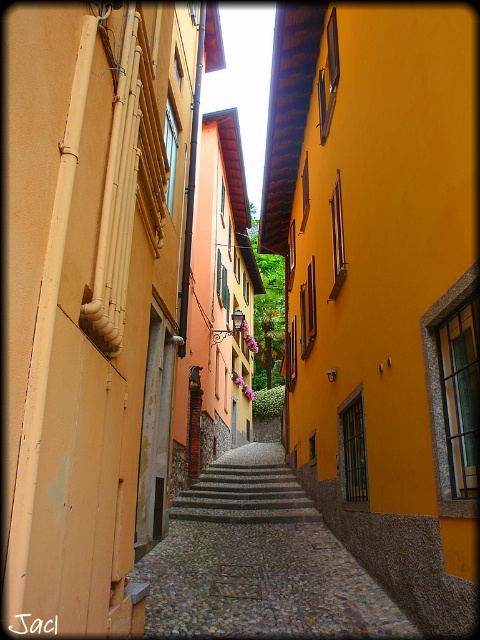
You are standing at the bottom of the cobblestone street looking up. There are two points marked on the buildings. The first point is at coordinates point [313,568] and the second is at point [291,486]. Which point is closer to you?

Point [313,568] is closer to the camera than point [291,486].

From the picture: You are standing at the bottom of the street and want to walk up to the top. Which path should you choose between the cobblestone path at center and the gray stone stairs at center if you want to stay closer to the buildings on the left side?

The cobblestone path at center is closer to the viewer than the gray stone stairs at center, so choosing the cobblestone path at center would keep you closer to the buildings on the left side as you ascend.